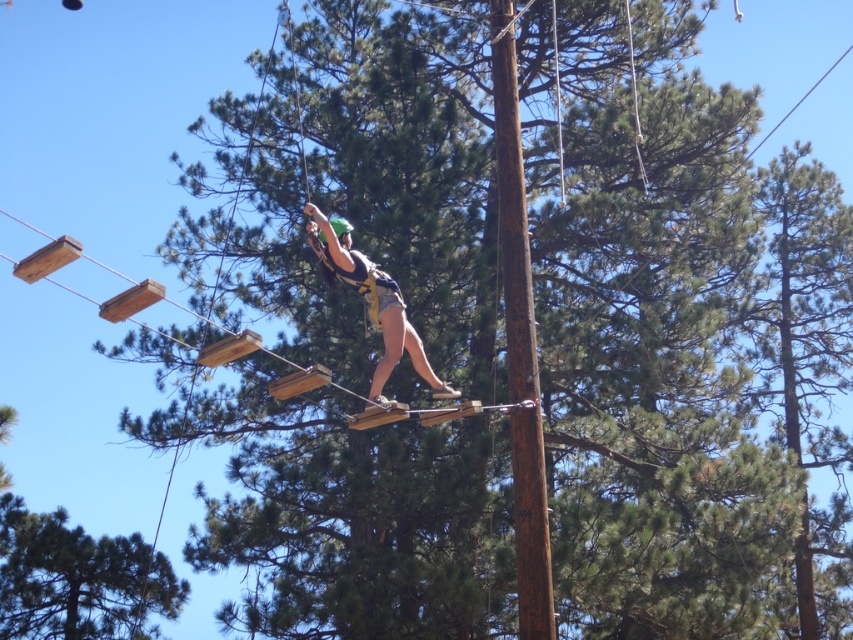
Is green pine tree at lower left positioned before matte black harness at center?

No.

Can you confirm if green pine tree at lower left is positioned above matte black harness at center?

No, green pine tree at lower left is not above matte black harness at center.

What are the coordinates of `green pine tree at lower left` in the screenshot? It's located at (77, 579).

Locate an element on the screen. This screenshot has height=640, width=853. green pine tree at lower left is located at coordinates (77, 579).

The width and height of the screenshot is (853, 640). Describe the element at coordinates (77, 579) in the screenshot. I see `green pine tree at lower left` at that location.

Locate an element on the screen. green pine tree at lower left is located at coordinates (77, 579).

In order to click on green pine tree at lower left in this screenshot , I will do `click(77, 579)`.

Does brown wood telegraph pole at center have a smaller size compared to matte black harness at center?

Yes.

Which is in front, point (520, 600) or point (328, 266)?

Point (328, 266)

The height and width of the screenshot is (640, 853). Find the location of `brown wood telegraph pole at center`. brown wood telegraph pole at center is located at coordinates (520, 340).